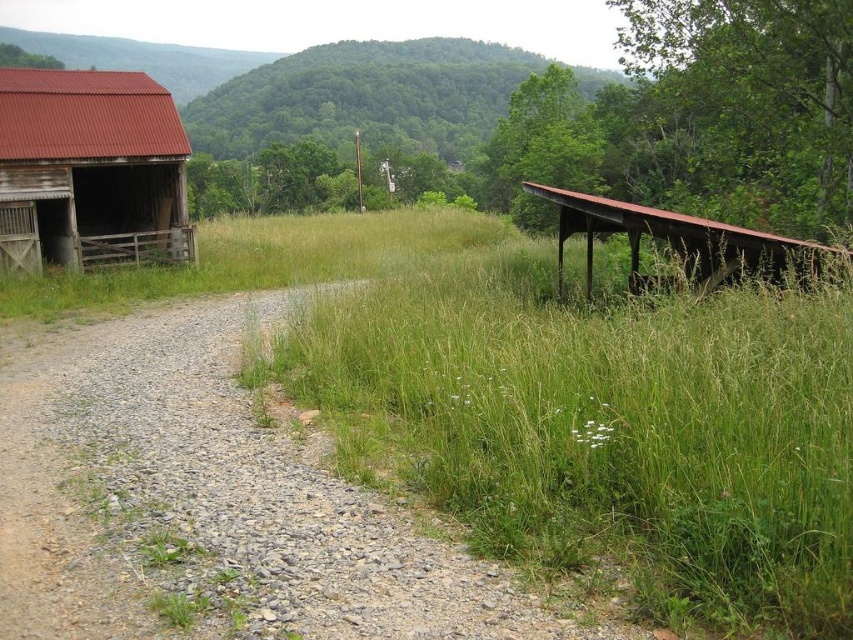
You are standing at the origin point of the image. Which direction should you move to reach the rusty corrugated metal barn at left?

The rusty corrugated metal barn at left is located at coordinate point 0.264 on the x axis and 0.106 on the y axis. Since the barn is at left side of the image, you should move towards the left direction to reach it.